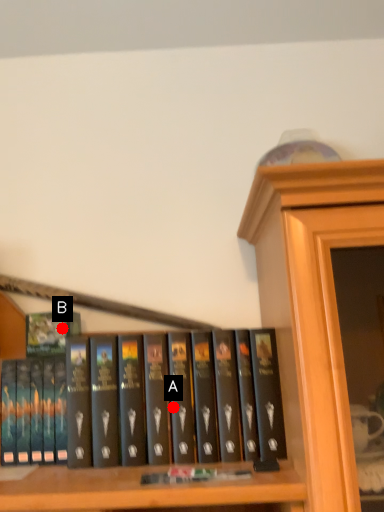
Question: Two points are circled on the image, labeled by A and B beside each circle. Which of the following is the farthest from the observer?

Choices:
 (A) A is further
 (B) B is further

Answer: (B)